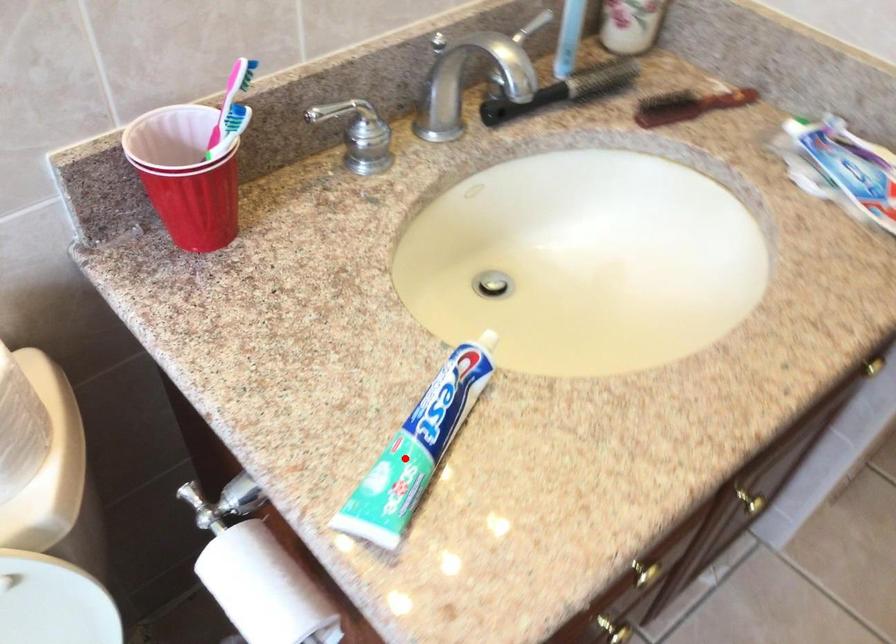
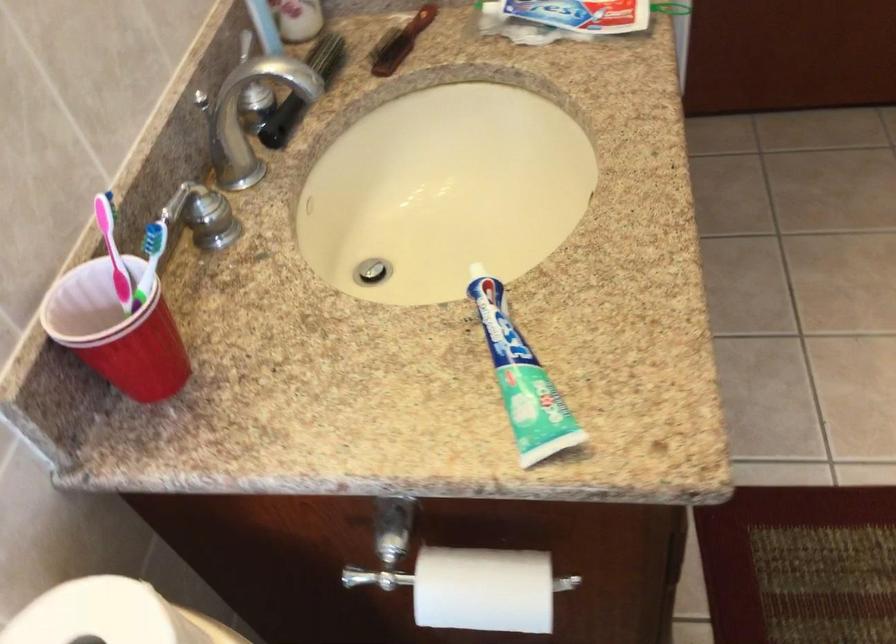
Where in the second image is the point corresponding to the highlighted location from the first image?

(521, 379)